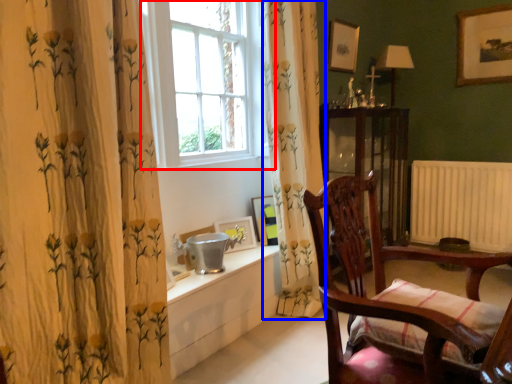
Question: Among these objects, which one is farthest to the camera, window (highlighted by a red box) or curtain (highlighted by a blue box)?

Choices:
 (A) window
 (B) curtain

Answer: (B)